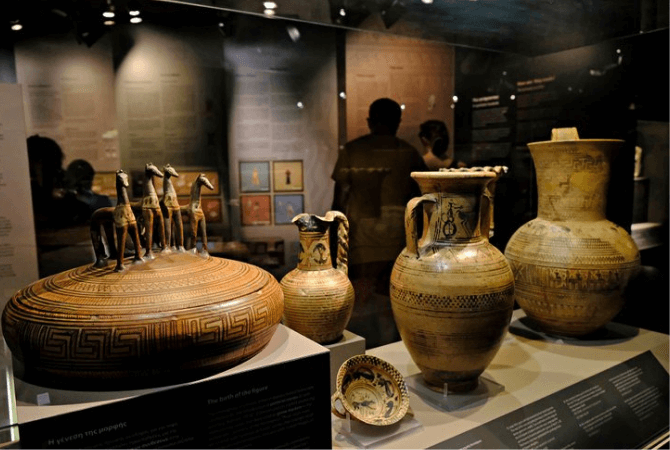
Where is `middle ceramic vase`? This screenshot has height=450, width=670. middle ceramic vase is located at coordinates (429, 266).